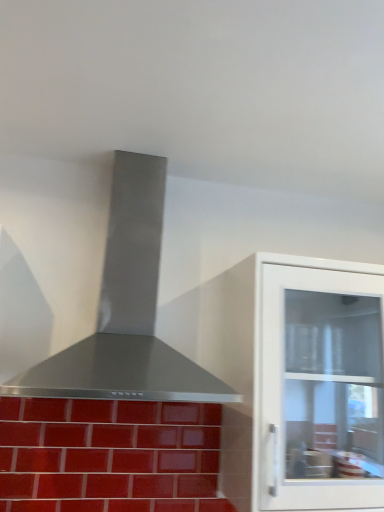
Question: Can stainless steel vent at center be found inside glossy ceramic tiles at lower left?

Choices:
 (A) yes
 (B) no

Answer: (B)

Question: Is glossy ceramic tiles at lower left oriented towards stainless steel vent at center?

Choices:
 (A) yes
 (B) no

Answer: (B)

Question: Is glossy ceramic tiles at lower left closer to the viewer compared to stainless steel vent at center?

Choices:
 (A) no
 (B) yes

Answer: (A)

Question: From a real-world perspective, is glossy ceramic tiles at lower left physically above stainless steel vent at center?

Choices:
 (A) no
 (B) yes

Answer: (A)

Question: From the image's perspective, does glossy ceramic tiles at lower left appear lower than stainless steel vent at center?

Choices:
 (A) yes
 (B) no

Answer: (A)

Question: Is white glossy cabinet at right inside or outside of stainless steel vent at center?

Choices:
 (A) inside
 (B) outside

Answer: (B)

Question: In terms of width, does white glossy cabinet at right look wider or thinner when compared to stainless steel vent at center?

Choices:
 (A) wide
 (B) thin

Answer: (B)

Question: Considering the positions of white glossy cabinet at right and stainless steel vent at center in the image, is white glossy cabinet at right bigger or smaller than stainless steel vent at center?

Choices:
 (A) big
 (B) small

Answer: (B)

Question: Does point (340, 376) appear closer or farther from the camera than point (23, 391)?

Choices:
 (A) closer
 (B) farther

Answer: (B)

Question: Considering the positions of stainless steel vent at center and glossy ceramic tiles at lower left in the image, is stainless steel vent at center taller or shorter than glossy ceramic tiles at lower left?

Choices:
 (A) short
 (B) tall

Answer: (B)

Question: From a real-world perspective, relative to glossy ceramic tiles at lower left, is stainless steel vent at center vertically above or below?

Choices:
 (A) above
 (B) below

Answer: (A)

Question: Is stainless steel vent at center wider or thinner than glossy ceramic tiles at lower left?

Choices:
 (A) wide
 (B) thin

Answer: (A)

Question: Considering the positions of point (104, 344) and point (1, 451), is point (104, 344) closer or farther from the camera than point (1, 451)?

Choices:
 (A) closer
 (B) farther

Answer: (A)

Question: Does point (31, 425) appear closer or farther from the camera than point (125, 209)?

Choices:
 (A) closer
 (B) farther

Answer: (A)

Question: From a real-world perspective, relative to stainless steel vent at center, is glossy ceramic tiles at lower left vertically above or below?

Choices:
 (A) below
 (B) above

Answer: (A)